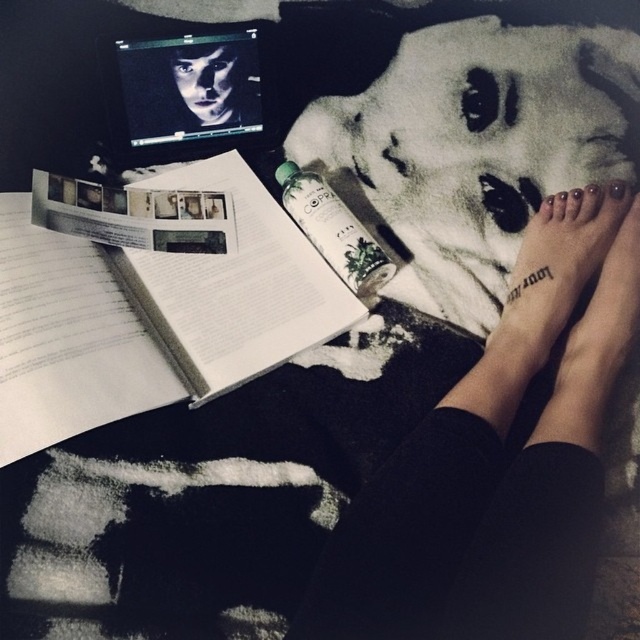
Who is more forward, (472, 371) or (620, 344)?

Point (620, 344) is in front.

Who is positioned more to the left, smooth skin feet at lower right or black matte feet at lower right?

smooth skin feet at lower right is more to the left.

Is point (534, 563) positioned in front of point (627, 292)?

Yes, it is in front of point (627, 292).

The image size is (640, 640). In order to click on smooth skin feet at lower right in this screenshot , I will do `click(497, 460)`.

Who is higher up, white paper book at center or black matte feet at lower right?

Positioned higher is white paper book at center.

Is white paper book at center taller than black matte feet at lower right?

Correct, white paper book at center is much taller as black matte feet at lower right.

The image size is (640, 640). In order to click on white paper book at center in this screenshot , I will do `click(152, 312)`.

Does black matte feet at lower right come in front of clear glass spray bottle at center?

Yes, black matte feet at lower right is closer to the viewer.

Between point (605, 284) and point (342, 256), which one is positioned in front?

Point (605, 284) is in front.

Is point (614, 273) positioned after point (355, 280)?

No, it is not.

This screenshot has height=640, width=640. In order to click on black matte feet at lower right in this screenshot , I will do `click(596, 346)`.